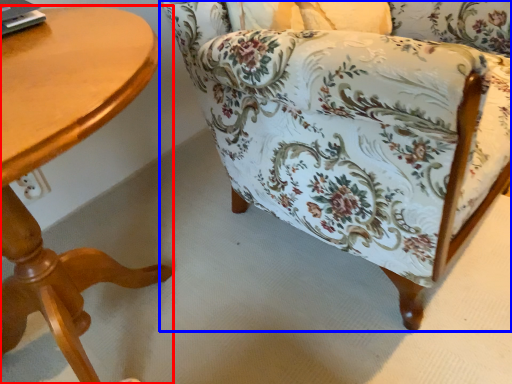
Question: Among these objects, which one is nearest to the camera, table (highlighted by a red box) or chair (highlighted by a blue box)?

Choices:
 (A) table
 (B) chair

Answer: (A)